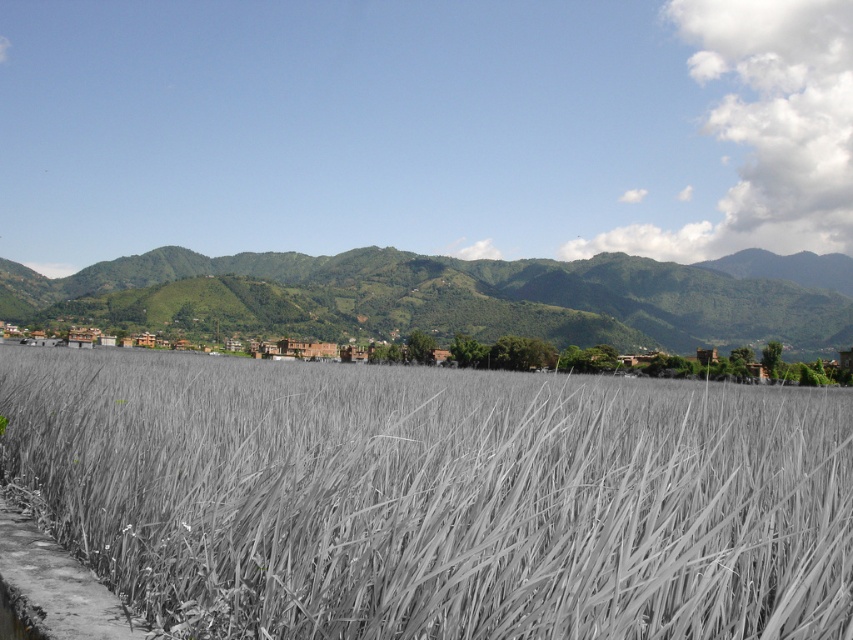
Question: Does gray matte rice field at center have a greater width compared to green leafy mountain at center?

Choices:
 (A) yes
 (B) no

Answer: (B)

Question: Among these points, which one is nearest to the camera?

Choices:
 (A) [x=543, y=582]
 (B) [x=439, y=317]

Answer: (A)

Question: Which object appears farthest from the camera in this image?

Choices:
 (A) green leafy mountain at center
 (B) gray matte rice field at center

Answer: (A)

Question: Is gray matte rice field at center above green leafy mountain at center?

Choices:
 (A) no
 (B) yes

Answer: (A)

Question: Is gray matte rice field at center closer to the viewer compared to green leafy mountain at center?

Choices:
 (A) yes
 (B) no

Answer: (A)